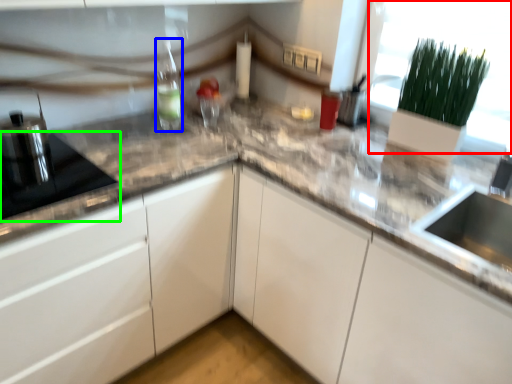
Question: Based on their relative distances, which object is nearer to glass door (highlighted by a red box)? Choose from bottle (highlighted by a blue box) and appliance (highlighted by a green box).

Choices:
 (A) bottle
 (B) appliance

Answer: (A)